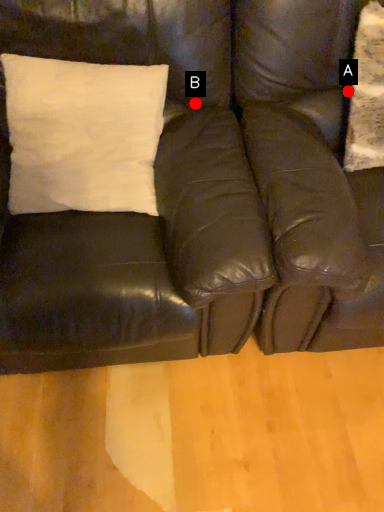
Question: Two points are circled on the image, labeled by A and B beside each circle. Which of the following is the farthest from the observer?

Choices:
 (A) A is further
 (B) B is further

Answer: (B)